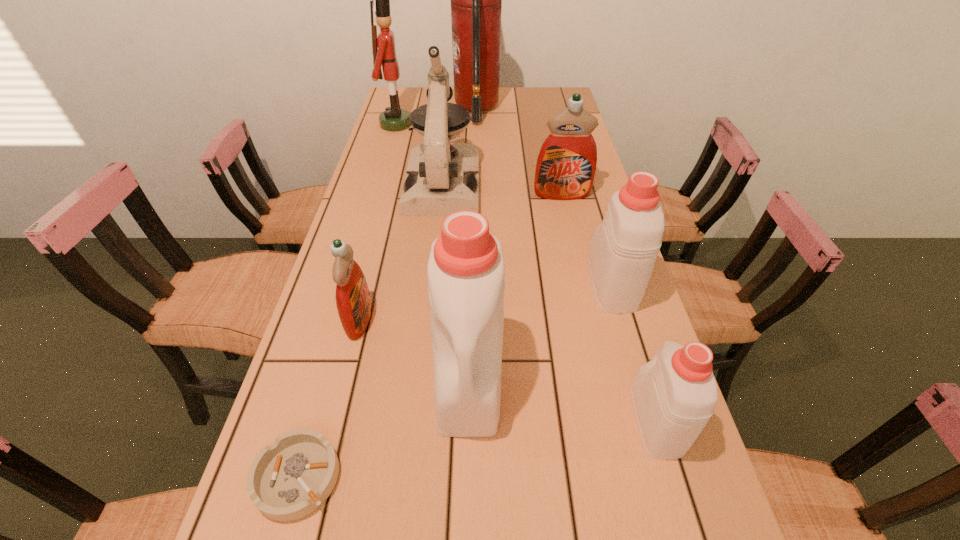
Where is `the smaller red detergent`? the smaller red detergent is located at coordinates (353, 301).

You are a GUI agent. You are given a task and a screenshot of the screen. Output one action in this format:
    pyautogui.click(x=<x>, y=<y>)
    Task: Click on the ashtray
    
    Given the screenshot: What is the action you would take?
    pyautogui.click(x=289, y=479)

Where is `vacant space positioned at the front of the red fire extinguisher where the nozzle is aimed`? The image size is (960, 540). vacant space positioned at the front of the red fire extinguisher where the nozzle is aimed is located at coordinates (515, 109).

Find the location of a particular element. free space located 0.120m on the front-facing side of the nutcracker is located at coordinates (444, 124).

You are a GUI agent. You are given a task and a screenshot of the screen. Output one action in this format:
    pyautogui.click(x=<x>, y=<y>)
    Task: Click on the free point located at the eyepiece of the microscope
    The image size is (960, 540).
    Given the screenshot: What is the action you would take?
    pyautogui.click(x=430, y=308)

Image resolution: width=960 pixels, height=540 pixels. I want to click on vacant space situated on the handle side of the tallest detergent, so click(468, 476).

This screenshot has width=960, height=540. What are the coordinates of `vacant space located 0.160m on the handle side of the second biggest white detergent` in the screenshot? It's located at (591, 217).

What are the coordinates of `vacant area located 0.130m on the handle side of the second biggest white detergent` in the screenshot? It's located at tap(593, 224).

Where is `vacant region located 0.090m on the handle side of the second biggest white detergent`? vacant region located 0.090m on the handle side of the second biggest white detergent is located at coordinates (596, 233).

Image resolution: width=960 pixels, height=540 pixels. Identify the location of vacant area located 0.170m on the front surface of the farther red detergent. (572, 239).